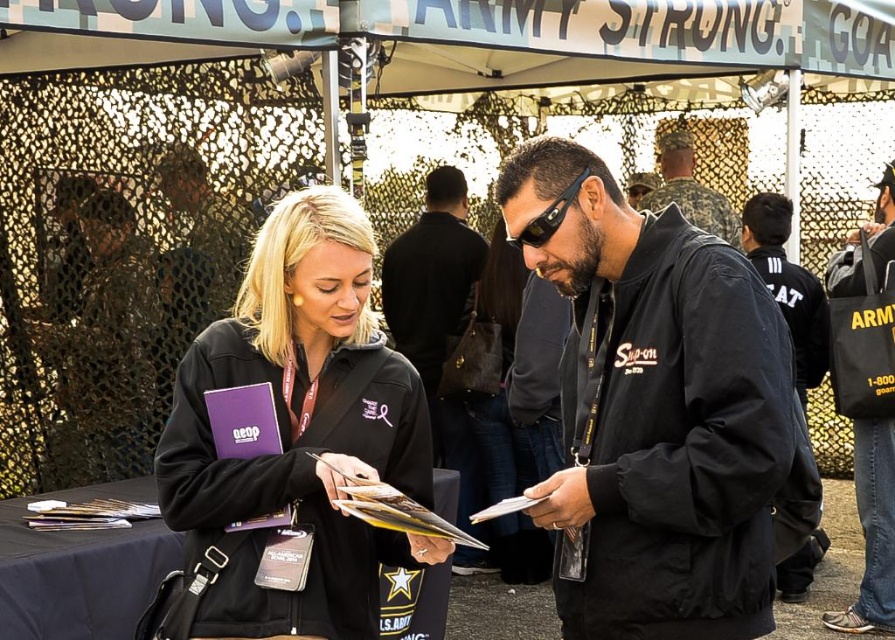
Can you confirm if black matte jacket at center is positioned above black leather jacket at center?

Yes.

Is black matte jacket at center below black leather jacket at center?

No.

Is point (702, 339) closer to viewer compared to point (465, 275)?

Yes, point (702, 339) is closer to viewer.

At what (x,y) coordinates should I click in order to perform the action: click on black matte jacket at center. Please return your answer as a coordinate pair (x, y). This screenshot has width=895, height=640. Looking at the image, I should click on (655, 410).

Is black matte jacket at center above black fabric bag at right?

Yes, black matte jacket at center is above black fabric bag at right.

Describe the element at coordinates (655, 410) in the screenshot. The image size is (895, 640). I see `black matte jacket at center` at that location.

Locate an element on the screen. This screenshot has height=640, width=895. black matte jacket at center is located at coordinates (655, 410).

Who is more forward, (858, 464) or (410, 296)?

Point (858, 464) is in front.

Is black fabric bag at right in front of black leather jacket at center?

Yes, it is.

The width and height of the screenshot is (895, 640). What do you see at coordinates (867, 401) in the screenshot?
I see `black fabric bag at right` at bounding box center [867, 401].

Locate an element on the screen. The image size is (895, 640). black fabric bag at right is located at coordinates (867, 401).